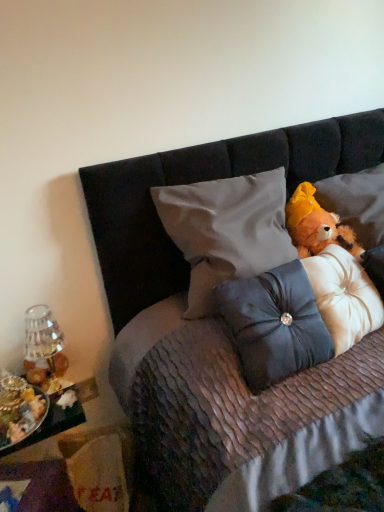
What do you see at coordinates (43, 348) in the screenshot? I see `transparent glass vase at left` at bounding box center [43, 348].

Describe the element at coordinates (344, 296) in the screenshot. The width and height of the screenshot is (384, 512). I see `satin/textured pillow at right, the 3th pillow viewed from the left` at that location.

Describe the element at coordinates (226, 230) in the screenshot. I see `satin gray pillow at center, positioned as the 1th pillow in left-to-right order` at that location.

Describe the element at coordinates (56, 418) in the screenshot. I see `metallic silver tray at lower left` at that location.

Describe the element at coordinates (274, 325) in the screenshot. I see `satin dark blue pillow at center, the second pillow from the right` at that location.

This screenshot has height=512, width=384. Find the location of `metallic silver tray at lower left`. metallic silver tray at lower left is located at coordinates (23, 417).

Does satin/textured pillow at right, the 3th pillow viewed from the left, turn towards transparent glass vase at left?

No, satin/textured pillow at right, the 3th pillow viewed from the left, is not facing towards transparent glass vase at left.

From a real-world perspective, does satin/textured pillow at right, the 3th pillow viewed from the left, sit lower than transparent glass vase at left?

No.

Based on the photo, who is taller, satin/textured pillow at right, the 3th pillow viewed from the left, or transparent glass vase at left?

satin/textured pillow at right, the 3th pillow viewed from the left, is taller.

Is satin/textured pillow at right, which is counted as the first pillow, starting from the right, outside of transparent glass vase at left?

Absolutely, satin/textured pillow at right, which is counted as the first pillow, starting from the right, is external to transparent glass vase at left.

How different are the orientations of satin gray pillow at center, positioned as the 1th pillow in left-to-right order, and satin/textured pillow at right, the 3th pillow viewed from the left, in degrees?

11.8 degrees.

Does satin gray pillow at center, positioned as the 1th pillow in left-to-right order, turn towards satin/textured pillow at right, the 3th pillow viewed from the left?

No, satin gray pillow at center, positioned as the 1th pillow in left-to-right order, is not oriented towards satin/textured pillow at right, the 3th pillow viewed from the left.

From the image's perspective, which is above, satin gray pillow at center, acting as the 3th pillow starting from the right, or satin/textured pillow at right, the 3th pillow viewed from the left?

From the image's view, satin gray pillow at center, acting as the 3th pillow starting from the right, is above.

Is satin gray pillow at center, positioned as the 1th pillow in left-to-right order, located outside metallic silver tray at lower left?

Indeed, satin gray pillow at center, positioned as the 1th pillow in left-to-right order, is completely outside metallic silver tray at lower left.

How many degrees apart are the facing directions of satin gray pillow at center, positioned as the 1th pillow in left-to-right order, and metallic silver tray at lower left?

They differ by 24.2 degrees in their facing directions.

Which object is positioned more to the left, satin gray pillow at center, acting as the 3th pillow starting from the right, or metallic silver tray at lower left?

metallic silver tray at lower left.

Is metallic silver tray at lower left at the back of satin gray pillow at center, positioned as the 1th pillow in left-to-right order?

No, metallic silver tray at lower left is not at the back of satin gray pillow at center, positioned as the 1th pillow in left-to-right order.

Where is `pillow lying on the right of fluffy orange teddy bear at upper right`? The width and height of the screenshot is (384, 512). pillow lying on the right of fluffy orange teddy bear at upper right is located at coordinates (344, 296).

Is fluffy orange teddy bear at upper right facing towards satin/textured pillow at right, the 3th pillow viewed from the left?

No, fluffy orange teddy bear at upper right is not facing towards satin/textured pillow at right, the 3th pillow viewed from the left.

Measure the distance between fluffy orange teddy bear at upper right and satin/textured pillow at right, the 3th pillow viewed from the left.

The distance of fluffy orange teddy bear at upper right from satin/textured pillow at right, the 3th pillow viewed from the left, is 6.36 inches.

From the image's perspective, is fluffy orange teddy bear at upper right below satin/textured pillow at right, the 3th pillow viewed from the left?

No, from the image's perspective, fluffy orange teddy bear at upper right is not below satin/textured pillow at right, the 3th pillow viewed from the left.

Which is closer to the camera, (x=43, y=343) or (x=311, y=365)?

Point (x=43, y=343).

You are a GUI agent. You are given a task and a screenshot of the screen. Output one action in this format:
    pyautogui.click(x=<x>, y=<y>)
    Task: Click on the 3rd pillow in front of the transparent glass vase at left, counting from the anchor's position
    The width and height of the screenshot is (384, 512).
    Given the screenshot: What is the action you would take?
    coord(274,325)

From the image's perspective, would you say transparent glass vase at left is shown under satin dark blue pillow at center, the 2th pillow viewed from the left?

Yes, from the image's perspective, transparent glass vase at left is below satin dark blue pillow at center, the 2th pillow viewed from the left.

Is transparent glass vase at left oriented towards satin dark blue pillow at center, the second pillow from the right?

No, transparent glass vase at left does not turn towards satin dark blue pillow at center, the second pillow from the right.

Is satin dark blue pillow at center, the 2th pillow viewed from the left, not near transparent glass vase at left?

Actually, satin dark blue pillow at center, the 2th pillow viewed from the left, and transparent glass vase at left are a little close together.

Could you tell me if satin dark blue pillow at center, the second pillow from the right, is facing transparent glass vase at left?

No, satin dark blue pillow at center, the second pillow from the right, is not oriented towards transparent glass vase at left.

Is point (292, 331) in front of point (54, 348)?

Yes.

From a real-world perspective, relative to transparent glass vase at left, is satin dark blue pillow at center, the 2th pillow viewed from the left, vertically above or below?

Clearly, from a real-world perspective, satin dark blue pillow at center, the 2th pillow viewed from the left, is above transparent glass vase at left.

Considering the sizes of metallic silver tray at lower left and satin gray pillow at center, acting as the 3th pillow starting from the right, in the image, is metallic silver tray at lower left taller or shorter than satin gray pillow at center, acting as the 3th pillow starting from the right,?

Clearly, metallic silver tray at lower left is shorter compared to satin gray pillow at center, acting as the 3th pillow starting from the right.

Is metallic silver tray at lower left oriented away from satin gray pillow at center, acting as the 3th pillow starting from the right?

No.

From a real-world perspective, is metallic silver tray at lower left beneath satin gray pillow at center, acting as the 3th pillow starting from the right?

Yes, from a real-world perspective, metallic silver tray at lower left is beneath satin gray pillow at center, acting as the 3th pillow starting from the right.

From the image's perspective, starting from the transparent glass vase at left, which pillow is the 2nd one above? Please provide its 2D coordinates.

[(344, 296)]

Locate an element on the screen. Image resolution: width=384 pixels, height=512 pixels. the 2nd pillow below the satin gray pillow at center, acting as the 3th pillow starting from the right (from a real-world perspective) is located at coordinates (344, 296).

Looking at the image, which one is located further to satin/textured pillow at right, the 3th pillow viewed from the left, satin gray pillow at center, acting as the 3th pillow starting from the right, or metallic silver tray at lower left?

The object further to satin/textured pillow at right, the 3th pillow viewed from the left, is metallic silver tray at lower left.

Looking at this image, considering their positions, is fluffy orange teddy bear at upper right positioned further to metallic silver tray at lower left than satin dark blue pillow at center, the second pillow from the right?

fluffy orange teddy bear at upper right.

Considering their positions, is metallic silver tray at lower left positioned further to satin gray pillow at center, positioned as the 1th pillow in left-to-right order, than transparent glass vase at left?

metallic silver tray at lower left lies further to satin gray pillow at center, positioned as the 1th pillow in left-to-right order, than the other object.

Which object lies nearer to the anchor point satin dark blue pillow at center, the second pillow from the right, fluffy orange teddy bear at upper right or satin/textured pillow at right, which is counted as the first pillow, starting from the right?

satin/textured pillow at right, which is counted as the first pillow, starting from the right, lies closer to satin dark blue pillow at center, the second pillow from the right, than the other object.

Based on their spatial positions, is satin/textured pillow at right, which is counted as the first pillow, starting from the right, or metallic silver tray at lower left further from fluffy orange teddy bear at upper right?

metallic silver tray at lower left.

In the scene shown: Considering their positions, is satin/textured pillow at right, the 3th pillow viewed from the left, positioned further to metallic silver tray at lower left than satin gray pillow at center, acting as the 3th pillow starting from the right?

satin/textured pillow at right, the 3th pillow viewed from the left, is further to metallic silver tray at lower left.

Looking at the image, which one is located further to satin dark blue pillow at center, the 2th pillow viewed from the left, satin gray pillow at center, positioned as the 1th pillow in left-to-right order, or fluffy orange teddy bear at upper right?

fluffy orange teddy bear at upper right lies further to satin dark blue pillow at center, the 2th pillow viewed from the left, than the other object.

Based on their spatial positions, is satin gray pillow at center, positioned as the 1th pillow in left-to-right order, or satin dark blue pillow at center, the second pillow from the right, closer to fluffy orange teddy bear at upper right?

satin gray pillow at center, positioned as the 1th pillow in left-to-right order, lies closer to fluffy orange teddy bear at upper right than the other object.

Where is `pillow between metallic silver tray at lower left and satin dark blue pillow at center, the 2th pillow viewed from the left, from left to right`? This screenshot has width=384, height=512. pillow between metallic silver tray at lower left and satin dark blue pillow at center, the 2th pillow viewed from the left, from left to right is located at coordinates (226, 230).

Identify the location of teddy bear between metallic silver tray at lower left and satin/textured pillow at right, the 3th pillow viewed from the left. click(x=316, y=225).

Where is `pillow between transparent glass vase at left and satin dark blue pillow at center, the 2th pillow viewed from the left, in the horizontal direction`? pillow between transparent glass vase at left and satin dark blue pillow at center, the 2th pillow viewed from the left, in the horizontal direction is located at coordinates (226, 230).

Locate an element on the screen. The width and height of the screenshot is (384, 512). stuff between metallic silver tray at lower left and satin dark blue pillow at center, the second pillow from the right is located at coordinates (23, 417).